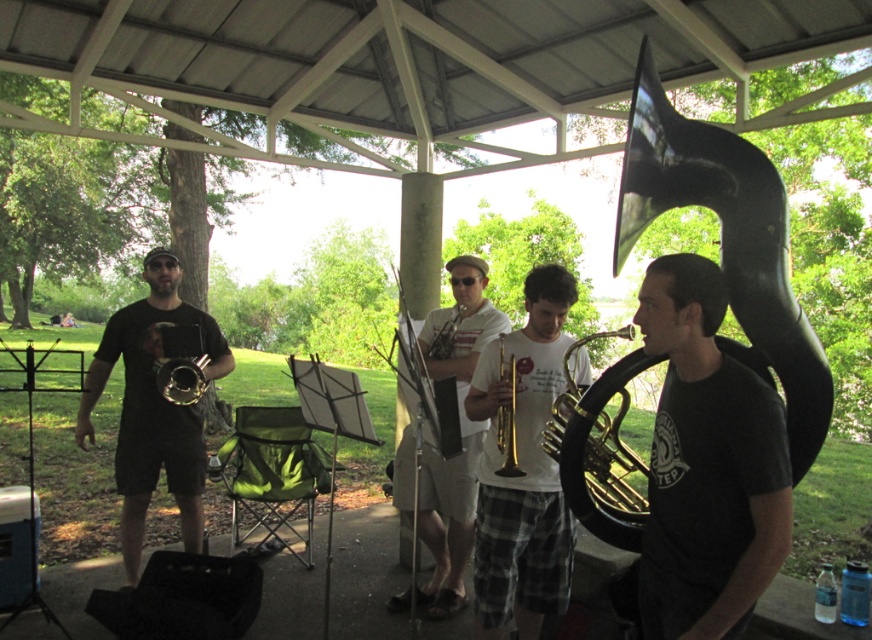
Between point (744, 588) and point (428, 316), which one is positioned behind?

Point (428, 316)

You are a GUI agent. You are given a task and a screenshot of the screen. Output one action in this format:
    pyautogui.click(x=<x>, y=<y>)
    Task: Click on the black matte tuba at right
    Image resolution: width=872 pixels, height=640 pixels.
    Given the screenshot: What is the action you would take?
    pyautogui.click(x=707, y=465)

Who is more forward, (x=665, y=627) or (x=439, y=484)?

Positioned in front is point (x=665, y=627).

This screenshot has height=640, width=872. Identify the location of black matte tuba at right. (707, 465).

From the picture: Is black polished tuba at right to the right of gold brass trumpet at left from the viewer's perspective?

Indeed, black polished tuba at right is positioned on the right side of gold brass trumpet at left.

Based on the photo, which is above, black polished tuba at right or gold brass trumpet at left?

Positioned higher is black polished tuba at right.

Who is more forward, (791, 301) or (162, 392)?

Point (791, 301) is in front.

The image size is (872, 640). I want to click on black polished tuba at right, so click(x=727, y=243).

The image size is (872, 640). What are the coordinates of `black polished tuba at right` in the screenshot? It's located at (727, 243).

Is point (805, 355) more distant than point (153, 461)?

No, it is in front of (153, 461).

Is point (690, 195) closer to camera compared to point (124, 317)?

Yes, point (690, 195) is in front of point (124, 317).

Find the location of `black polished tuba at right`. black polished tuba at right is located at coordinates pos(727,243).